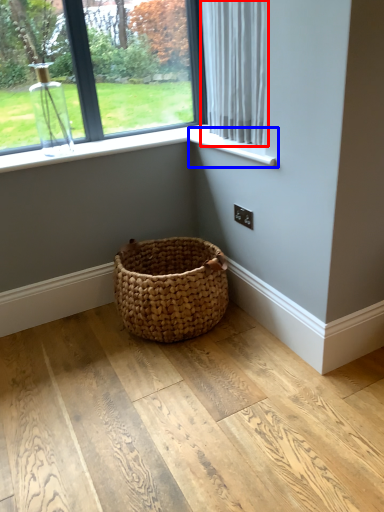
Question: Which object is closer to the camera taking this photo, curtain (highlighted by a red box) or window sill (highlighted by a blue box)?

Choices:
 (A) curtain
 (B) window sill

Answer: (A)